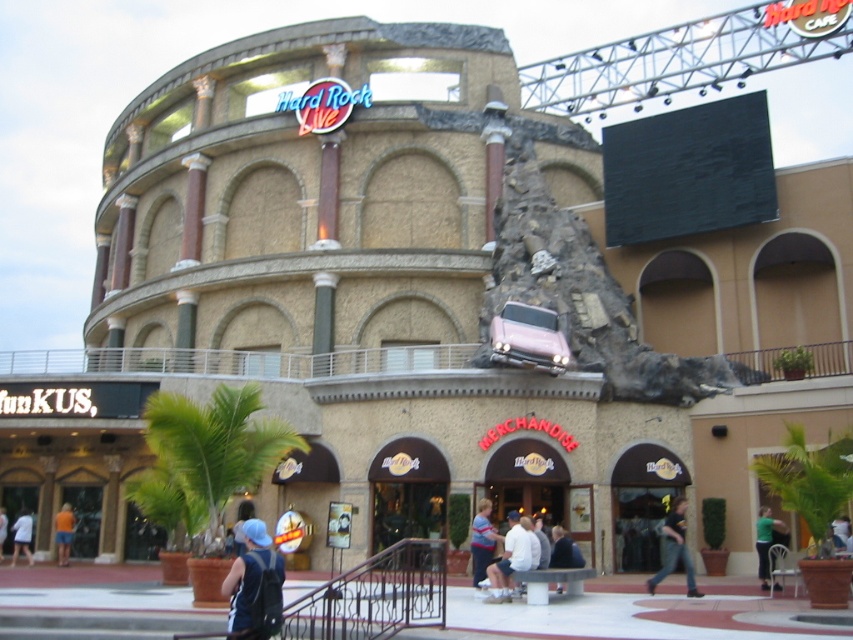
You are a photographer at the Hard Rock Live venue and need to capture a photo of the green fabric shirt at lower right and orange fabric shorts at lower left. Which object should you zoom in on to ensure it fills the frame more?

The green fabric shirt at lower right has a smaller size compared to orange fabric shorts at lower left, so you should zoom in on the green fabric shirt at lower right to ensure it fills the frame more.

You are a photographer at the Hard Rock Live venue. You need to capture a photo of the dark blue shirt at lower center and the orange fabric shorts at lower left. Which clothing item will appear taller in the photo?

The orange fabric shorts at lower left will appear taller in the photo because the dark blue shirt at lower center is shorter than the orange fabric shorts at lower left.

You are a photographer setting up a tripod in front of the Hard Rock Live venue. You notice denim jeans at lower right and orange fabric shorts at lower left in the foreground. Which clothing item has a greater width when viewed from your position?

The denim jeans at lower right has a greater width than the orange fabric shorts at lower left.